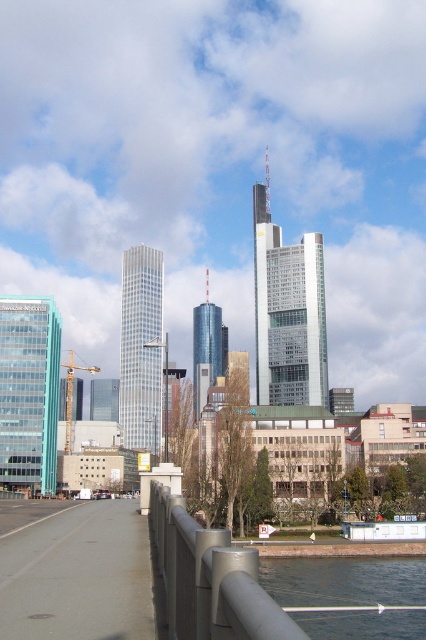
Question: Is metallic gray railing at lower center wider than blue water at lower right?

Choices:
 (A) yes
 (B) no

Answer: (B)

Question: Does metallic gray railing at lower center appear under blue water at lower right?

Choices:
 (A) yes
 (B) no

Answer: (B)

Question: Which point appears farthest from the camera in this image?

Choices:
 (A) (337, 616)
 (B) (180, 593)

Answer: (A)

Question: Does metallic gray railing at lower center lie behind blue water at lower right?

Choices:
 (A) yes
 (B) no

Answer: (B)

Question: Which object is farther from the camera taking this photo?

Choices:
 (A) blue water at lower right
 (B) metallic gray railing at lower center

Answer: (A)